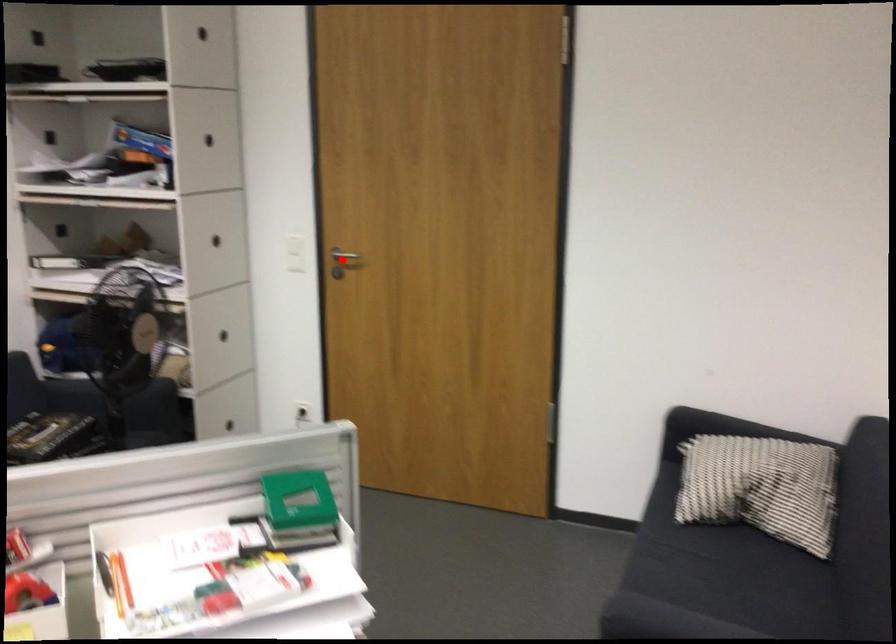
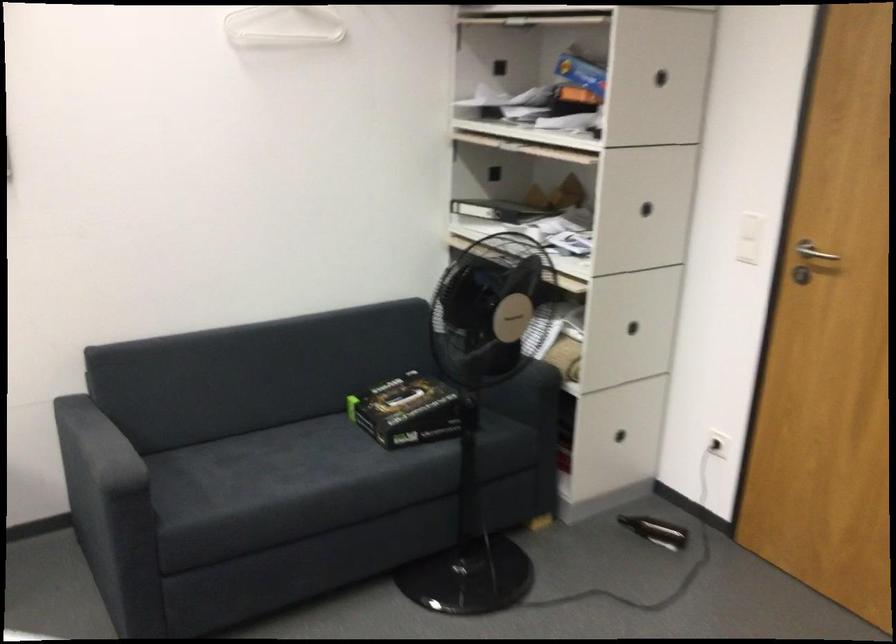
Where in the second image is the point corresponding to the highlighted location from the first image?

(813, 252)